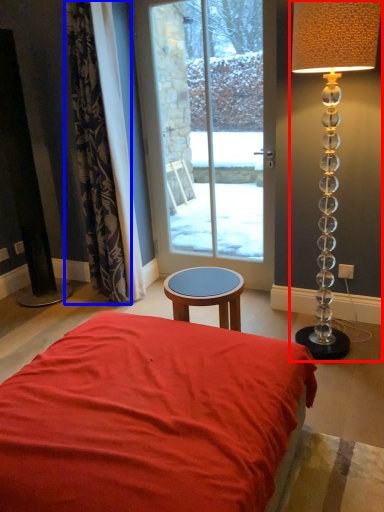
Question: Which point is further to the camera, lamp (highlighted by a red box) or curtain (highlighted by a blue box)?

Choices:
 (A) lamp
 (B) curtain

Answer: (B)